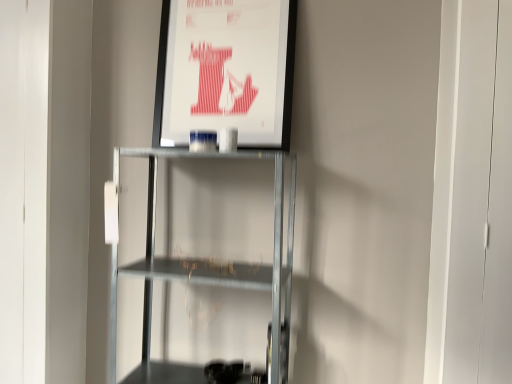
Describe the element at coordinates (206, 269) in the screenshot. The height and width of the screenshot is (384, 512). I see `metallic gray shelf at center` at that location.

I want to click on metallic gray shelf at center, so click(x=206, y=269).

Where is `matte paper poster at upper center`? The image size is (512, 384). matte paper poster at upper center is located at coordinates (226, 71).

Image resolution: width=512 pixels, height=384 pixels. What do you see at coordinates (226, 71) in the screenshot?
I see `matte paper poster at upper center` at bounding box center [226, 71].

What is the approximate width of matte paper poster at upper center?

matte paper poster at upper center is 3.93 inches wide.

Where is `metallic gray shelf at center`? This screenshot has width=512, height=384. metallic gray shelf at center is located at coordinates (206, 269).

Considering the relative positions of matte paper poster at upper center and metallic gray shelf at center in the image provided, is matte paper poster at upper center to the left of metallic gray shelf at center from the viewer's perspective?

In fact, matte paper poster at upper center is to the right of metallic gray shelf at center.

Considering the positions of objects matte paper poster at upper center and metallic gray shelf at center in the image provided, who is in front, matte paper poster at upper center or metallic gray shelf at center?

metallic gray shelf at center is in front.

Considering the positions of points (185, 37) and (110, 319), is point (185, 37) closer to camera compared to point (110, 319)?

That is True.

From the image's perspective, is matte paper poster at upper center below metallic gray shelf at center?

Incorrect, from the image's perspective, matte paper poster at upper center is higher than metallic gray shelf at center.

From a real-world perspective, is matte paper poster at upper center on metallic gray shelf at center?

Yes, from a real-world perspective, matte paper poster at upper center is on top of metallic gray shelf at center.

Which of these two, matte paper poster at upper center or metallic gray shelf at center, is wider?

Wider between the two is metallic gray shelf at center.

Considering the sizes of objects matte paper poster at upper center and metallic gray shelf at center in the image provided, who is shorter, matte paper poster at upper center or metallic gray shelf at center?

matte paper poster at upper center.

Can you confirm if matte paper poster at upper center is bigger than metallic gray shelf at center?

Actually, matte paper poster at upper center might be smaller than metallic gray shelf at center.

Is matte paper poster at upper center inside the boundaries of metallic gray shelf at center, or outside?

matte paper poster at upper center is spatially situated outside metallic gray shelf at center.

Is matte paper poster at upper center far from metallic gray shelf at center?

That's not correct — matte paper poster at upper center is a little close to metallic gray shelf at center.

Is matte paper poster at upper center oriented away from metallic gray shelf at center?

No, matte paper poster at upper center is not facing away from metallic gray shelf at center.

The width and height of the screenshot is (512, 384). In the image, there is a matte paper poster at upper center. Identify the location of shelf below it (from a real-world perspective). (206, 269).

Is metallic gray shelf at center at the left side of matte paper poster at upper center?

Indeed, metallic gray shelf at center is positioned on the left side of matte paper poster at upper center.

Does metallic gray shelf at center lie behind matte paper poster at upper center?

No, it is not.

Does point (197, 367) lie in front of point (222, 42)?

That is False.

From the image's perspective, is metallic gray shelf at center positioned above or below matte paper poster at upper center?

metallic gray shelf at center is situated lower than matte paper poster at upper center in the image.

From a real-world perspective, is metallic gray shelf at center located beneath matte paper poster at upper center?

Indeed, from a real-world perspective, metallic gray shelf at center is positioned beneath matte paper poster at upper center.

Between metallic gray shelf at center and matte paper poster at upper center, which one has smaller width?

With smaller width is matte paper poster at upper center.

Which of these two, metallic gray shelf at center or matte paper poster at upper center, stands taller?

metallic gray shelf at center is taller.

Looking at the image, does metallic gray shelf at center seem bigger or smaller compared to matte paper poster at upper center?

In the image, metallic gray shelf at center appears to be larger than matte paper poster at upper center.

Is metallic gray shelf at center not inside matte paper poster at upper center?

That's correct, metallic gray shelf at center is outside of matte paper poster at upper center.

Is metallic gray shelf at center directly adjacent to matte paper poster at upper center?

No, metallic gray shelf at center is not touching matte paper poster at upper center.

Is metallic gray shelf at center turned away from matte paper poster at upper center?

No, matte paper poster at upper center is not at the back of metallic gray shelf at center.

The width and height of the screenshot is (512, 384). What are the coordinates of `shelf in front of the matte paper poster at upper center` in the screenshot? It's located at (206, 269).

You are a GUI agent. You are given a task and a screenshot of the screen. Output one action in this format:
    pyautogui.click(x=<x>, y=<y>)
    Task: Click on the shelf in front of the matte paper poster at upper center
    
    Given the screenshot: What is the action you would take?
    pyautogui.click(x=206, y=269)

Where is `shelf below the matte paper poster at upper center (from a real-world perspective)`? The height and width of the screenshot is (384, 512). shelf below the matte paper poster at upper center (from a real-world perspective) is located at coordinates (206, 269).